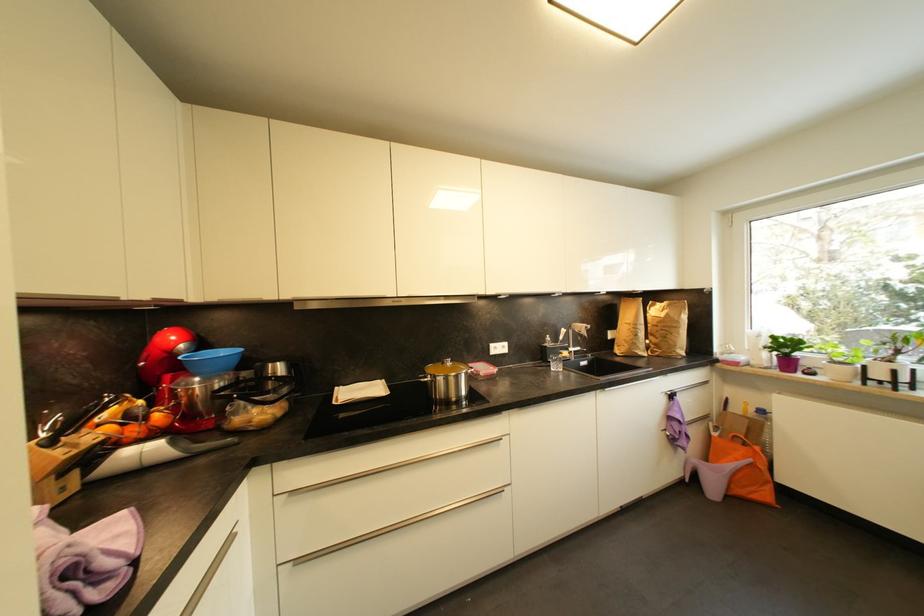
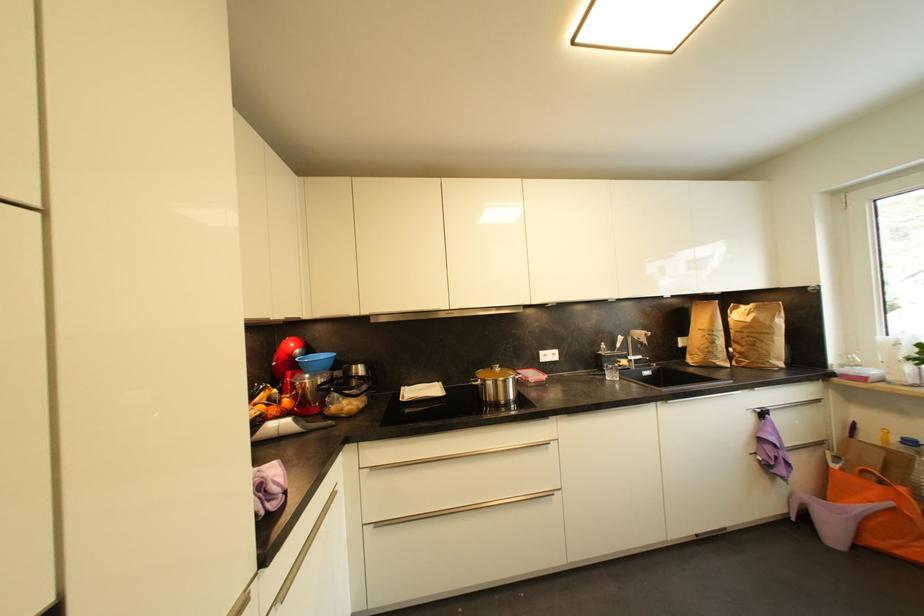
The point at (302, 562) is marked in the first image. Where is the corresponding point in the second image?

(382, 527)